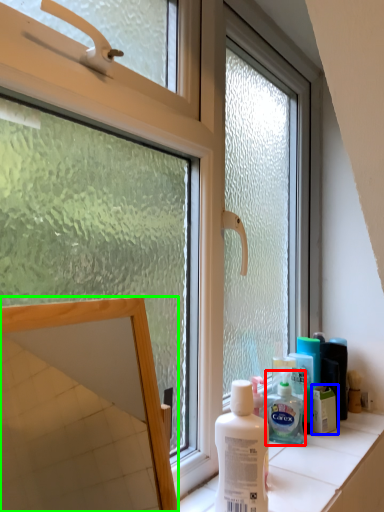
Question: Considering the real-world distances, which object is farthest from shaving cream (highlighted by a red box)? product (highlighted by a blue box) or mirror (highlighted by a green box)?

Choices:
 (A) product
 (B) mirror

Answer: (B)